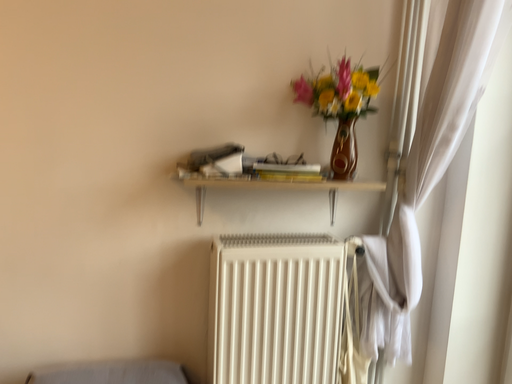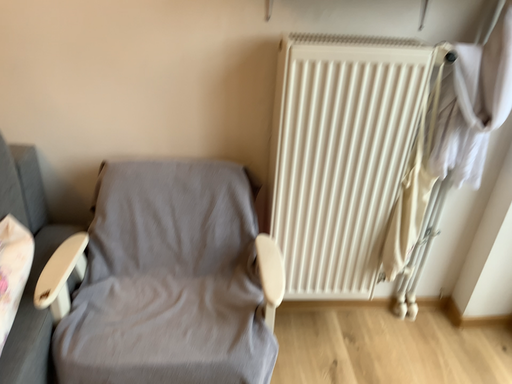
Question: How did the camera likely rotate when shooting the video?

Choices:
 (A) rotated downward
 (B) rotated upward

Answer: (A)